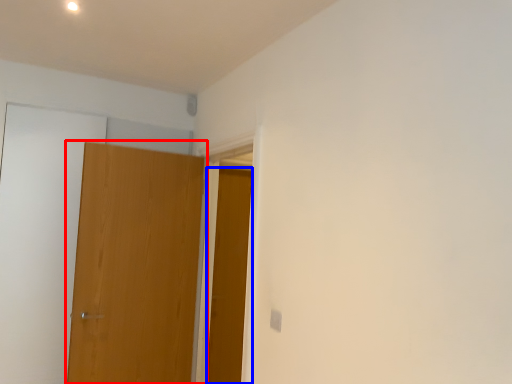
Question: Which object is closer to the camera taking this photo, door (highlighted by a red box) or door (highlighted by a blue box)?

Choices:
 (A) door
 (B) door

Answer: (A)